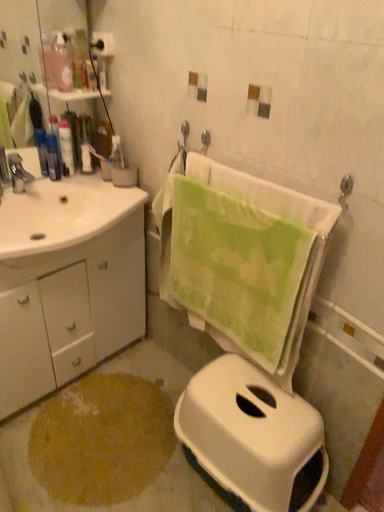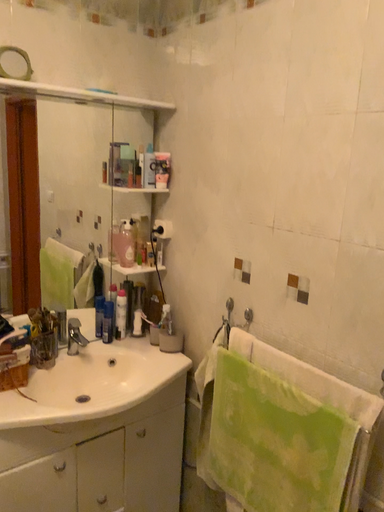
Question: Which way did the camera rotate in the video?

Choices:
 (A) rotated downward
 (B) rotated upward

Answer: (B)